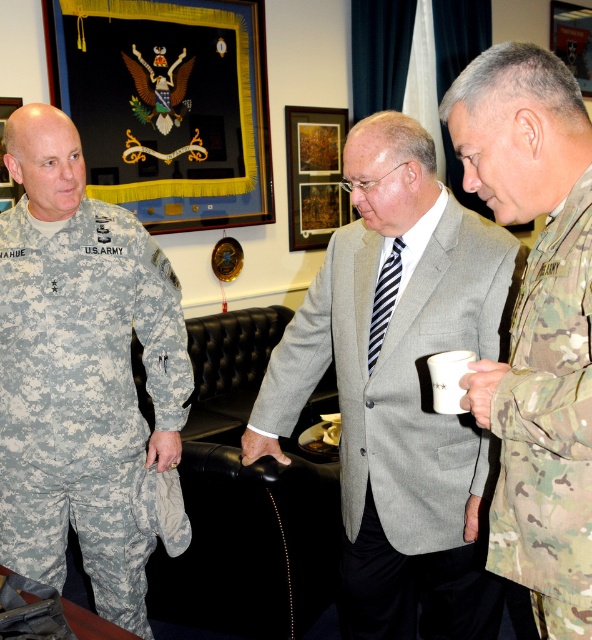
Who is lower down, gray wool suit at center or camouflage uniform at left?

Positioned lower is gray wool suit at center.

Between point (316, 378) and point (69, 378), which one is positioned in front?

Point (69, 378) is in front.

Which is in front, point (398, 316) or point (11, 394)?

Point (398, 316) is more forward.

You are a GUI agent. You are given a task and a screenshot of the screen. Output one action in this format:
    pyautogui.click(x=<x>, y=<y>)
    Task: Click on the gray wool suit at center
    This screenshot has width=592, height=640.
    Given the screenshot: What is the action you would take?
    pyautogui.click(x=398, y=388)

Does gray wool suit at center appear on the left side of camouflage fabric uniform at right?

Indeed, gray wool suit at center is positioned on the left side of camouflage fabric uniform at right.

Is point (381, 122) less distant than point (539, 547)?

That is False.

I want to click on gray wool suit at center, so click(398, 388).

Does camouflage uniform at left have a smaller size compared to camouflage fabric uniform at right?

No, camouflage uniform at left is not smaller than camouflage fabric uniform at right.

From the picture: Who is more distant from viewer, (104, 512) or (577, 557)?

Point (104, 512)

You are a GUI agent. You are given a task and a screenshot of the screen. Output one action in this format:
    pyautogui.click(x=<x>, y=<y>)
    Task: Click on the camouflage uniform at left
    This screenshot has height=640, width=592.
    Given the screenshot: What is the action you would take?
    pyautogui.click(x=82, y=372)